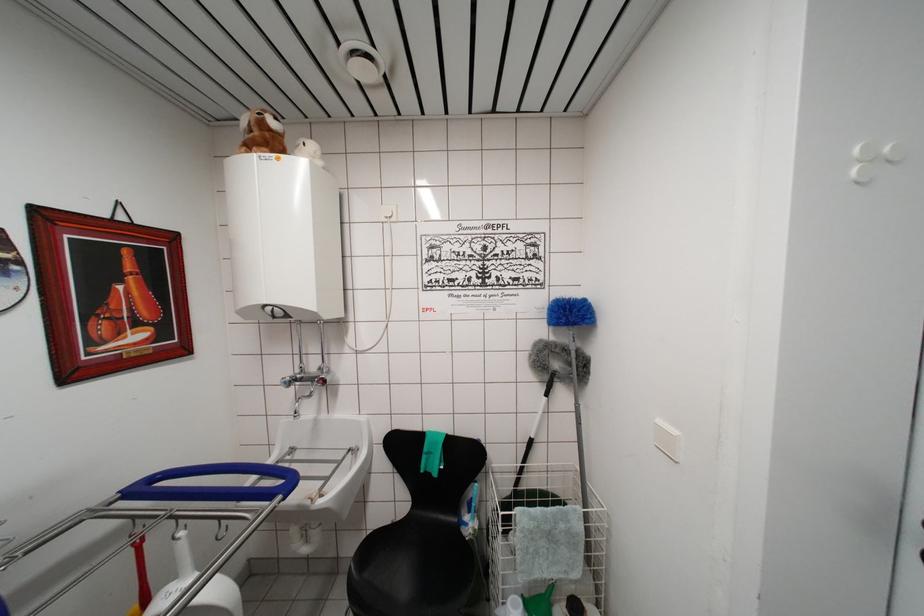
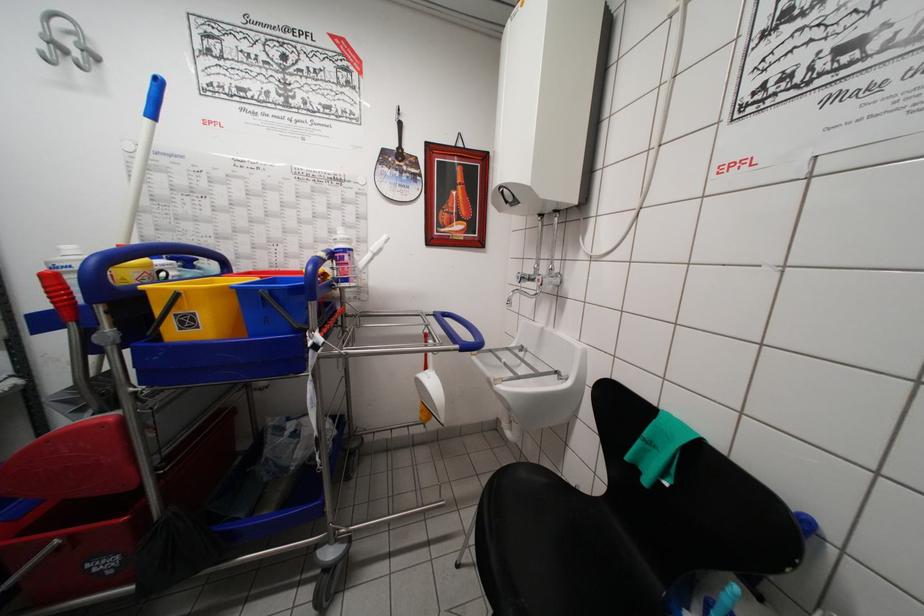
Where in the second image is the point corresponding to point (276, 322) from the first image?

(511, 207)